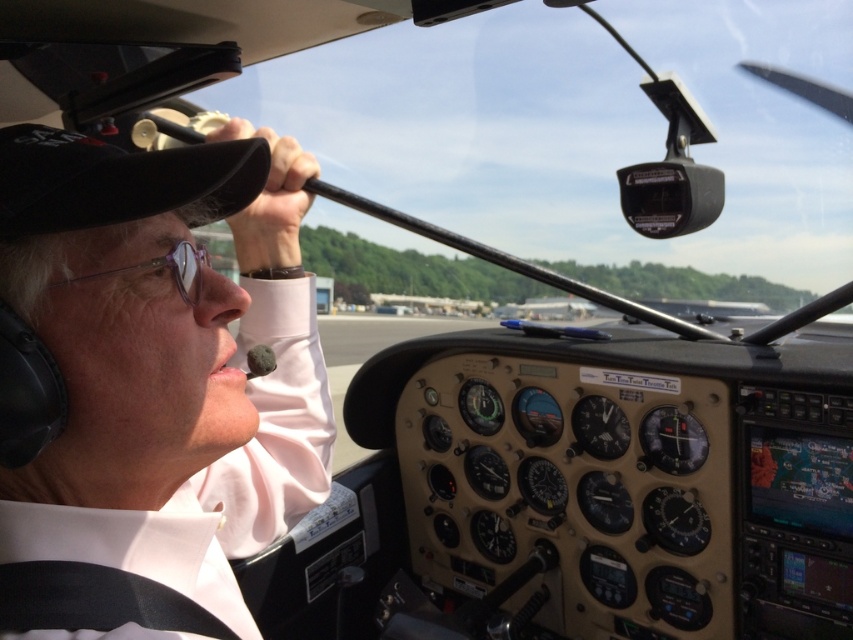
Which of these two, matte black headset at upper left or clear plastic glasses at upper left, stands taller?

Standing taller between the two is matte black headset at upper left.

Does matte black headset at upper left have a greater height compared to clear plastic glasses at upper left?

Yes, matte black headset at upper left is taller than clear plastic glasses at upper left.

Is point (94, 316) positioned before point (198, 285)?

Yes, point (94, 316) is closer to viewer.

Find the location of a particular element. matte black headset at upper left is located at coordinates (173, 394).